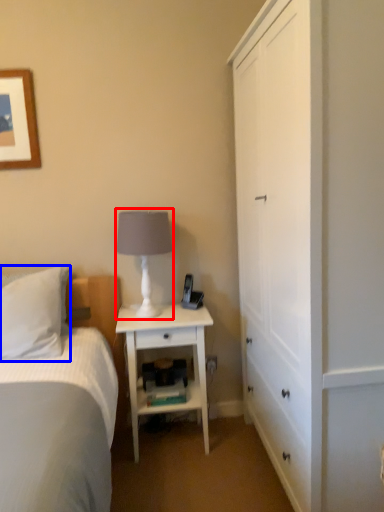
Question: Which point is closer to the camera, table lamp (highlighted by a red box) or pillow (highlighted by a blue box)?

Choices:
 (A) table lamp
 (B) pillow

Answer: (B)